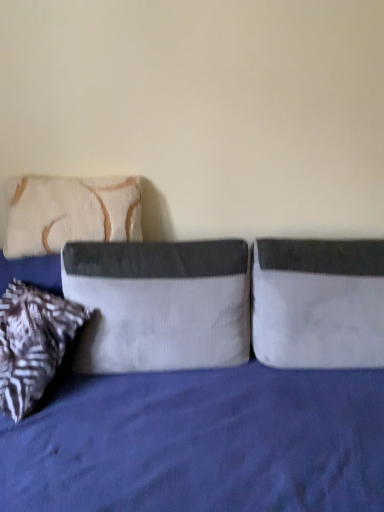
Question: From the image's perspective, relative to velvet gray pillow at center, which ranks as the second pillow in left-to-right order, is white fabric pillow at right, placed as the first pillow when sorted from right to left, above or below?

Choices:
 (A) above
 (B) below

Answer: (B)

Question: In terms of width, does white fabric pillow at right, the 3th pillow when ordered from left to right, look wider or thinner when compared to velvet gray pillow at center, which appears as the 2th pillow when viewed from the right?

Choices:
 (A) wide
 (B) thin

Answer: (B)

Question: Which object is positioned farthest from the white fabric pillow at right, the 3th pillow when ordered from left to right?

Choices:
 (A) beige textured pillow at left, placed as the first pillow when sorted from left to right
 (B) velvet blue bed at center
 (C) velvet gray pillow at center, which ranks as the second pillow in left-to-right order

Answer: (A)

Question: Based on their relative distances, which object is nearer to the white fabric pillow at right, the 3th pillow when ordered from left to right?

Choices:
 (A) velvet gray pillow at center, which ranks as the second pillow in left-to-right order
 (B) beige textured pillow at left, placed as the first pillow when sorted from left to right
 (C) velvet blue bed at center

Answer: (A)